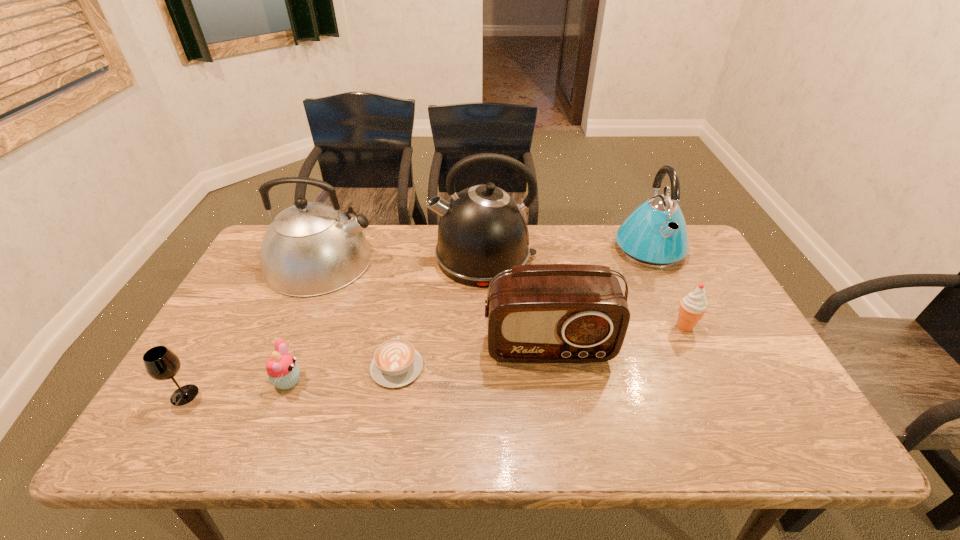
Where is `kettle that is the second nearest to the cupcake`? This screenshot has width=960, height=540. kettle that is the second nearest to the cupcake is located at coordinates (482, 231).

I want to click on vacant region that satisfies the following two spatial constraints: 1. at the spout of the rightmost kettle; 2. from the spout of the leftmost kettle, so click(x=655, y=261).

Where is `blank area in the image that satisfies the following two spatial constraints: 1. at the spout of the rightmost kettle; 2. from the spout of the leftmost kettle`? blank area in the image that satisfies the following two spatial constraints: 1. at the spout of the rightmost kettle; 2. from the spout of the leftmost kettle is located at coordinates (655, 261).

Where is `free region that satisfies the following two spatial constraints: 1. on the back side of the wineglass; 2. on the right side of the icecream`? Image resolution: width=960 pixels, height=540 pixels. free region that satisfies the following two spatial constraints: 1. on the back side of the wineglass; 2. on the right side of the icecream is located at coordinates (225, 326).

This screenshot has height=540, width=960. I want to click on free point that satisfies the following two spatial constraints: 1. on the side of the icecream with the handle; 2. on the left side of the cappuccino, so click(x=404, y=326).